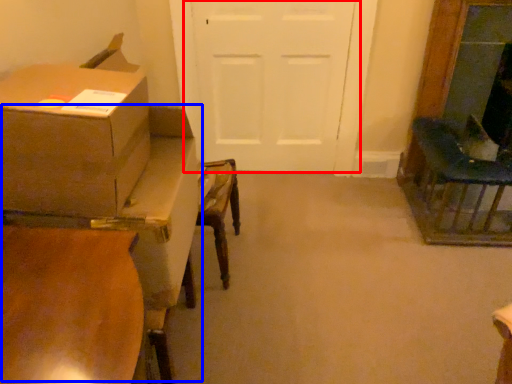
Question: Which of the following is the farthest to the observer, door (highlighted by a red box) or table (highlighted by a blue box)?

Choices:
 (A) door
 (B) table

Answer: (A)